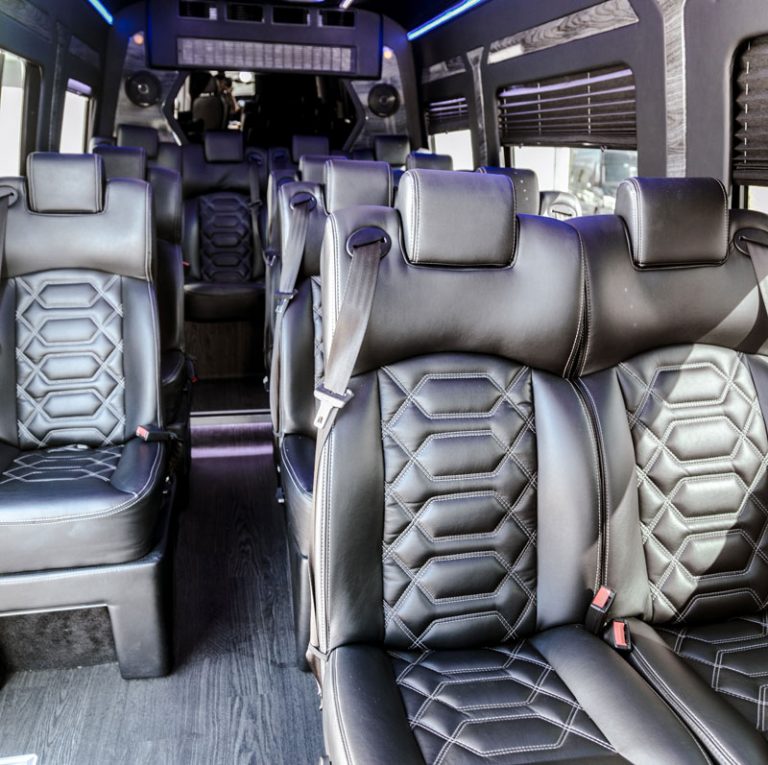
Where is `natural light`? This screenshot has height=765, width=768. natural light is located at coordinates (702, 490).